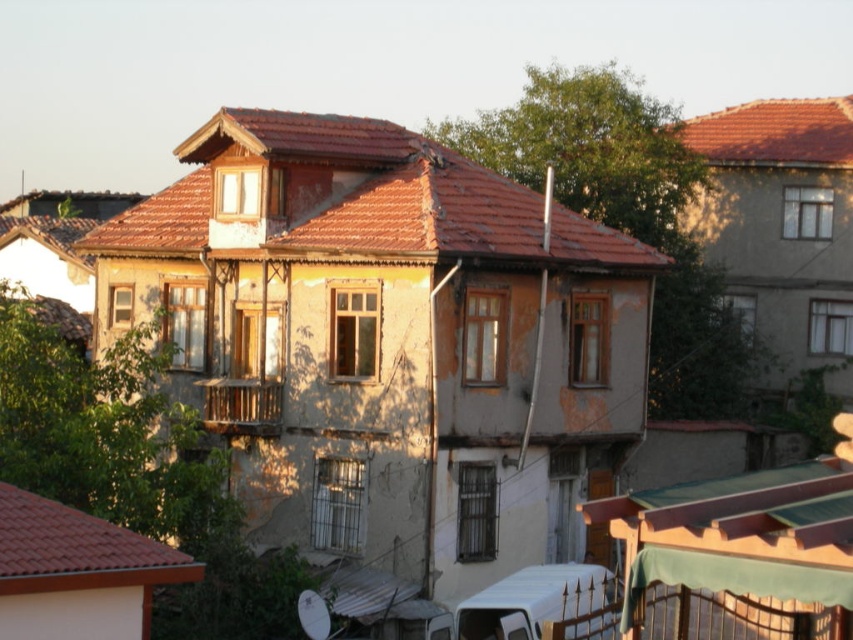
You are standing in front of the residential building and want to take a photo of both the brown tile roof at center and the red tile roof at lower left. Can you see both roofs clearly in the same frame without moving your camera?

The red tile roof at lower left is behind the brown tile roof at center, so it might be partially obscured, making it difficult to see both clearly in the same frame without moving the camera.

You are a delivery person trying to determine the best route to deliver packages to the two roofs in the image. The brown tile roof at center and the red tile roof at lower left. Which roof should you ascend first if you want to deliver packages to both roofs in the most efficient way possible?

The brown tile roof at center is much taller than the red tile roof at lower left, so you should ascend the brown tile roof at center first. This way, you can then descend to the shorter red tile roof at lower left without needing to climb again.

You are a window washer standing on the ground floor of the building. You need to clean both the brown tile roof at center and the red tile roof at upper right. Which roof should you tackle first if you want to start with the one that is closer to you?

The brown tile roof at center is positioned under the red tile roof at upper right, so the brown tile roof at center is closer to you. You should start with the brown tile roof at center.